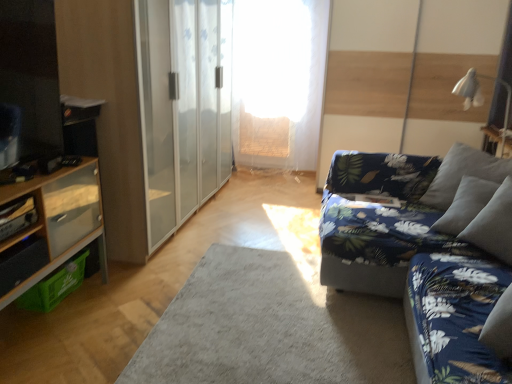
Image resolution: width=512 pixels, height=384 pixels. Identify the location of vacant region below gray soft rug at center (from a real-world perspective). (281, 309).